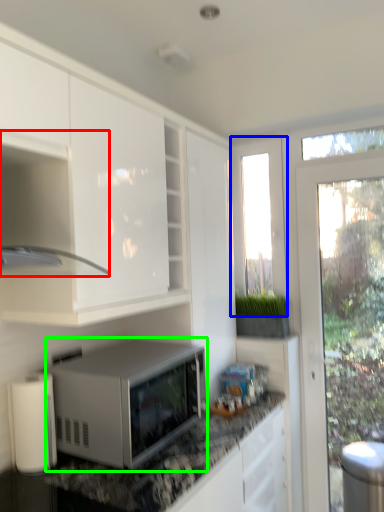
Question: Which object is the farthest from cabinetry (highlighted by a red box)? Choose among these: window screen (highlighted by a blue box) or microwave oven (highlighted by a green box).

Choices:
 (A) window screen
 (B) microwave oven

Answer: (A)